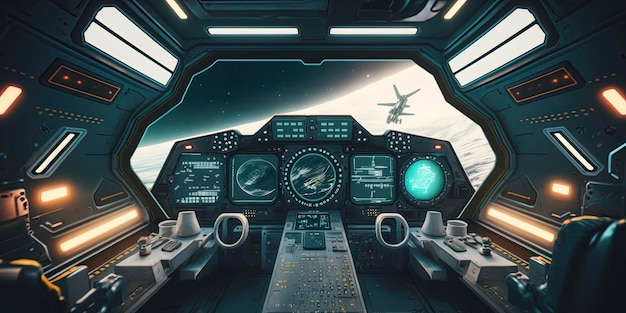
You are a GUI agent. You are given a task and a screenshot of the screen. Output one action in this format:
    pyautogui.click(x=<x>, y=<y>)
    Task: Click on the dark bluish gray floor
    Image resolution: width=626 pixels, height=313 pixels.
    Given the screenshot: What is the action you would take?
    pyautogui.click(x=407, y=296), pyautogui.click(x=233, y=293)